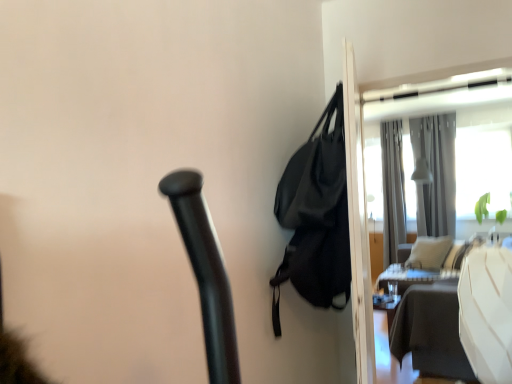
Question: Can we say gray fabric curtain at upper right, which appears as the first curtain when viewed from the left, lies outside white glossy table at right?

Choices:
 (A) yes
 (B) no

Answer: (A)

Question: Is gray fabric curtain at upper right, acting as the 2th curtain starting from the right, thinner than white glossy table at right?

Choices:
 (A) yes
 (B) no

Answer: (A)

Question: From a real-world perspective, is gray fabric curtain at upper right, which appears as the first curtain when viewed from the left, located beneath white glossy table at right?

Choices:
 (A) no
 (B) yes

Answer: (A)

Question: From the image's perspective, is gray fabric curtain at upper right, acting as the 2th curtain starting from the right, on top of white glossy table at right?

Choices:
 (A) yes
 (B) no

Answer: (A)

Question: Is gray fabric curtain at upper right, acting as the 2th curtain starting from the right, to the right of white glossy table at right from the viewer's perspective?

Choices:
 (A) no
 (B) yes

Answer: (B)

Question: Is black matte bag at upper right to the left or to the right of gray fabric curtain at upper right, acting as the 2th curtain starting from the right, in the image?

Choices:
 (A) right
 (B) left

Answer: (B)

Question: From their relative heights in the image, would you say black matte bag at upper right is taller or shorter than gray fabric curtain at upper right, which appears as the first curtain when viewed from the left?

Choices:
 (A) short
 (B) tall

Answer: (A)

Question: Is black matte bag at upper right inside or outside of gray fabric curtain at upper right, acting as the 2th curtain starting from the right?

Choices:
 (A) inside
 (B) outside

Answer: (B)

Question: In terms of width, does black matte bag at upper right look wider or thinner when compared to gray fabric curtain at upper right, acting as the 2th curtain starting from the right?

Choices:
 (A) thin
 (B) wide

Answer: (B)

Question: From a real-world perspective, is gray fabric curtain at upper right, which appears as the first curtain when viewed from the left, physically located above or below silky gray curtain at upper right, positioned as the second curtain in left-to-right order?

Choices:
 (A) below
 (B) above

Answer: (A)

Question: Would you say gray fabric curtain at upper right, which appears as the first curtain when viewed from the left, is inside or outside silky gray curtain at upper right, positioned as the second curtain in left-to-right order?

Choices:
 (A) inside
 (B) outside

Answer: (B)

Question: From the image's perspective, is gray fabric curtain at upper right, acting as the 2th curtain starting from the right, positioned above or below silky gray curtain at upper right, positioned as the second curtain in left-to-right order?

Choices:
 (A) above
 (B) below

Answer: (B)

Question: Considering the positions of gray fabric curtain at upper right, acting as the 2th curtain starting from the right, and silky gray curtain at upper right, positioned as the second curtain in left-to-right order, in the image, is gray fabric curtain at upper right, acting as the 2th curtain starting from the right, wider or thinner than silky gray curtain at upper right, positioned as the second curtain in left-to-right order,?

Choices:
 (A) wide
 (B) thin

Answer: (A)

Question: Is point (454, 155) closer or farther from the camera than point (389, 289)?

Choices:
 (A) closer
 (B) farther

Answer: (B)

Question: Is silky gray curtain at upper right, acting as the 1th curtain starting from the right, to the left or to the right of white glossy table at right in the image?

Choices:
 (A) right
 (B) left

Answer: (A)